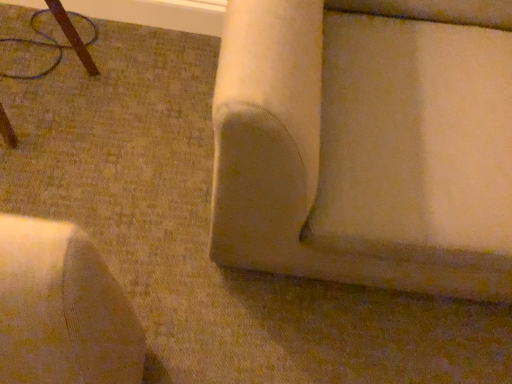
Question: Is brown wood table at upper left, arranged as the first furniture when viewed from the left, spatially inside beige fabric couch at center, which is the first furniture from right to left, or outside of it?

Choices:
 (A) outside
 (B) inside

Answer: (A)

Question: In terms of width, does brown wood table at upper left, the 2th furniture positioned from the right, look wider or thinner when compared to beige fabric couch at center, which is the first furniture from right to left?

Choices:
 (A) thin
 (B) wide

Answer: (A)

Question: Does point (80, 41) appear closer or farther from the camera than point (357, 173)?

Choices:
 (A) closer
 (B) farther

Answer: (B)

Question: From the image's perspective, relative to brown wood table at upper left, the 2th furniture positioned from the right, is beige fabric couch at center, acting as the 2th furniture starting from the left, above or below?

Choices:
 (A) below
 (B) above

Answer: (A)

Question: Considering the positions of beige fabric couch at center, which is the first furniture from right to left, and brown wood table at upper left, the 2th furniture positioned from the right, in the image, is beige fabric couch at center, which is the first furniture from right to left, taller or shorter than brown wood table at upper left, the 2th furniture positioned from the right,?

Choices:
 (A) tall
 (B) short

Answer: (A)

Question: Considering the positions of beige fabric couch at center, which is the first furniture from right to left, and brown wood table at upper left, the 2th furniture positioned from the right, in the image, is beige fabric couch at center, which is the first furniture from right to left, wider or thinner than brown wood table at upper left, the 2th furniture positioned from the right,?

Choices:
 (A) wide
 (B) thin

Answer: (A)

Question: Considering their positions, is beige fabric couch at center, which is the first furniture from right to left, located in front of or behind brown wood table at upper left, arranged as the first furniture when viewed from the left?

Choices:
 (A) front
 (B) behind

Answer: (A)